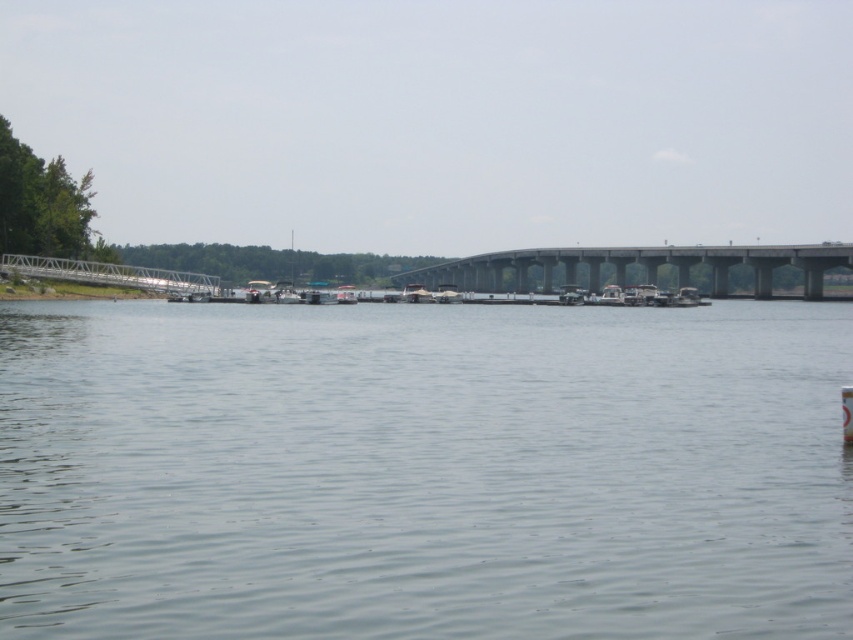
Question: Is gray smooth water at center to the left of gray concrete bridge at center from the viewer's perspective?

Choices:
 (A) yes
 (B) no

Answer: (A)

Question: Does gray smooth water at center have a larger size compared to gray concrete bridge at center?

Choices:
 (A) no
 (B) yes

Answer: (A)

Question: Which point is closer to the camera?

Choices:
 (A) (305, 472)
 (B) (566, 266)

Answer: (A)

Question: Which object appears closest to the camera in this image?

Choices:
 (A) gray concrete bridge at center
 (B) gray smooth water at center

Answer: (B)

Question: In this image, where is gray smooth water at center located relative to gray concrete bridge at center?

Choices:
 (A) above
 (B) below

Answer: (B)

Question: Which of the following is the farthest from the observer?

Choices:
 (A) (444, 280)
 (B) (74, 614)

Answer: (A)